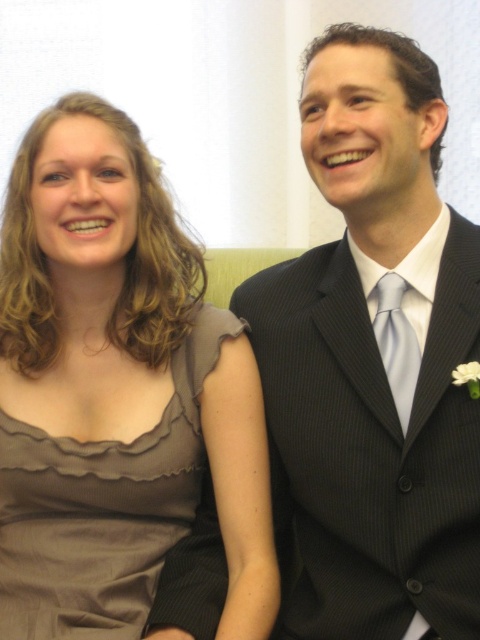
You are a photographer standing at a distance of 36 inches from the scene. You want to capture a closeup shot of the satin dress at left. Will you need to move closer or farther away to focus on it?

The satin dress at left is 36.47 inches from the viewer. Since you are currently 36 inches away, you need to move slightly farther away to focus on the satin dress at left.

From the picture: You are a photographer at a formal event. You need to adjust the lighting to ensure both the satin dress at left and the light blue silk tie at center are well illuminated. Given their sizes, which object requires a wider light beam to cover its surface?

The satin dress at left requires a wider light beam because it has a larger size compared to the light blue silk tie at center.

You are a photographer setting up for a formal event. You need to position a spotlight at coordinates point 0.797, 0.212 to highlight the satin dress at left. Based on the scene description, is the spotlight placement accurate?

Yes, the spotlight placement at point (101, 509) is accurate because the satin dress at left is located exactly at that coordinate according to the objects description.